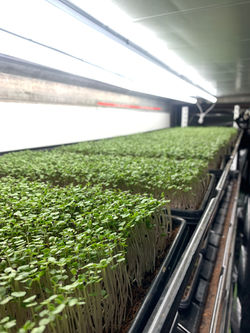
The height and width of the screenshot is (333, 250). Find the location of `bottom right corner empty space`. bottom right corner empty space is located at coordinates pos(248,330).